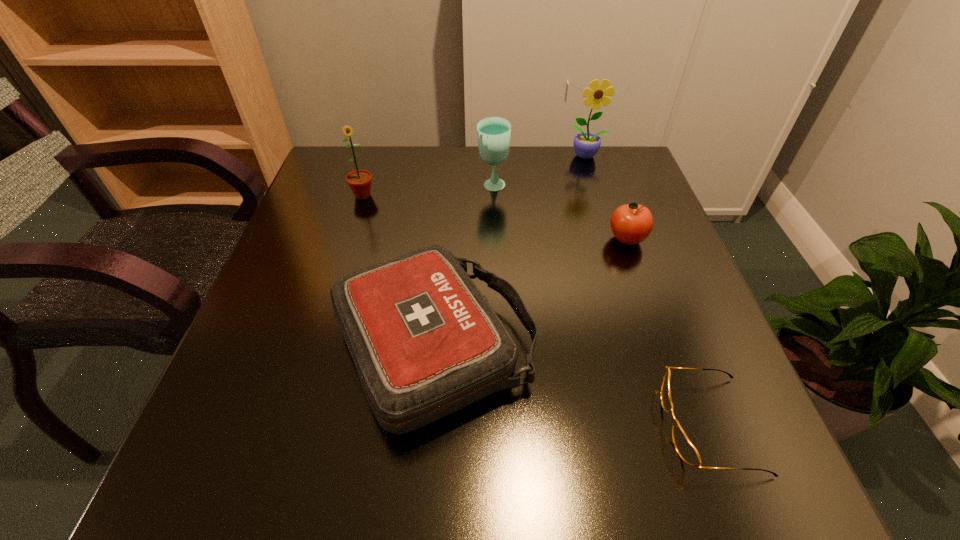
This screenshot has height=540, width=960. I want to click on sunflower that is at the right edge, so [x=586, y=144].

Find the location of a particular element. apple located at the right edge is located at coordinates (631, 223).

At what (x,y) coordinates should I click in order to perform the action: click on spectacles that is at the right edge. Please return your answer as a coordinate pair (x, y). Looking at the image, I should click on (686, 450).

Find the location of a particular element. object at the far left corner is located at coordinates (359, 181).

At what (x,y) coordinates should I click in order to perform the action: click on object at the near left corner. Please return your answer as a coordinate pair (x, y). This screenshot has height=540, width=960. Looking at the image, I should click on tap(425, 342).

This screenshot has width=960, height=540. In order to click on object positioned at the far right corner in this screenshot , I will do `click(586, 144)`.

Where is `object at the near right corner`? The image size is (960, 540). object at the near right corner is located at coordinates pyautogui.click(x=686, y=450).

Find the location of a particular element. The image size is (960, 540). free space at the far edge is located at coordinates (424, 184).

The image size is (960, 540). In the image, there is a desktop. Identify the location of free region at the near edge. (444, 444).

Locate an element on the screen. The height and width of the screenshot is (540, 960). vacant space at the left edge of the desktop is located at coordinates (348, 261).